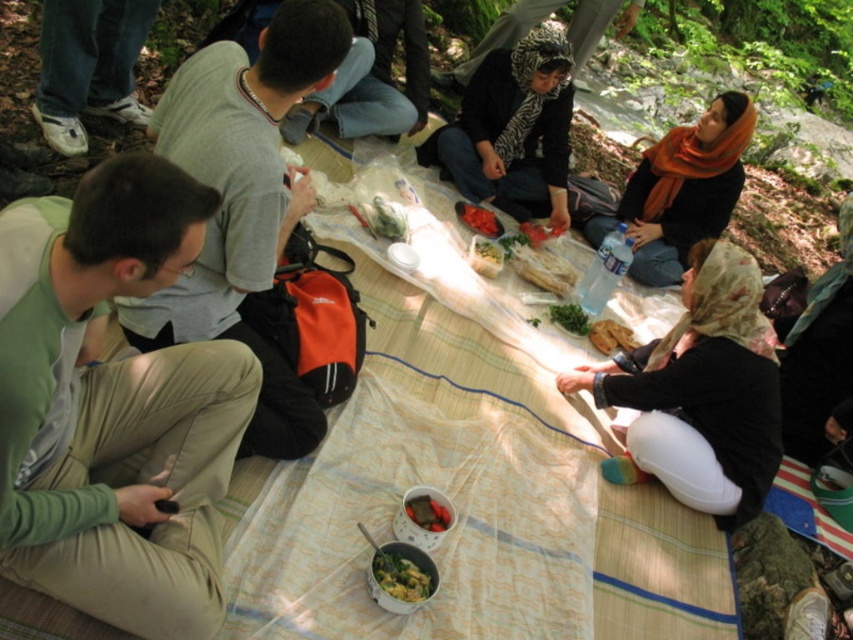
Between point (614, 339) and point (570, 308), which one is positioned in front?

Positioned in front is point (614, 339).

Can you confirm if brown crumbly bread at center is positioned to the right of green leafy vegetable at center?

Yes, brown crumbly bread at center is to the right of green leafy vegetable at center.

Does point (606, 353) lie in front of point (552, 312)?

Yes.

You are a GUI agent. You are given a task and a screenshot of the screen. Output one action in this format:
    pyautogui.click(x=<x>, y=<y>)
    Task: Click on the brown crumbly bread at center
    This screenshot has height=640, width=853.
    Given the screenshot: What is the action you would take?
    pyautogui.click(x=610, y=337)

Who is lower down, matte gray shirt at left or denim jeans at upper left?

Positioned lower is matte gray shirt at left.

Between matte gray shirt at left and denim jeans at upper left, which one appears on the right side from the viewer's perspective?

matte gray shirt at left

Does point (198, 145) come closer to viewer compared to point (97, 113)?

Yes, it is in front of point (97, 113).

At what (x,y) coordinates should I click in order to perform the action: click on matte gray shirt at left. Please return your answer as a coordinate pair (x, y). This screenshot has width=853, height=640. Looking at the image, I should click on (242, 202).

Does point (9, 321) come behind point (428, 577)?

No, (9, 321) is closer to viewer.

Is the position of green cotton shirt at center more distant than that of green matte bowl at center?

No, green cotton shirt at center is in front of green matte bowl at center.

This screenshot has height=640, width=853. I want to click on green cotton shirt at center, so click(113, 404).